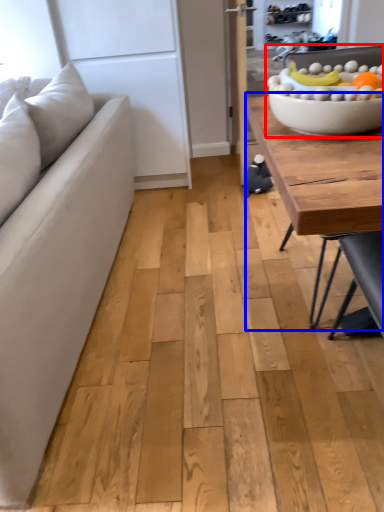
Question: Among these objects, which one is nearest to the camera, bowl (highlighted by a red box) or coffee table (highlighted by a blue box)?

Choices:
 (A) bowl
 (B) coffee table

Answer: (A)